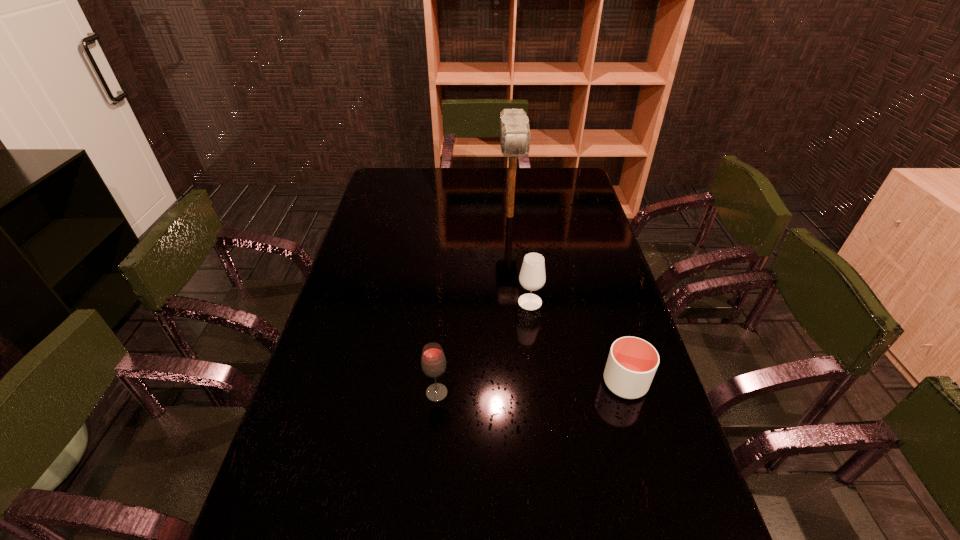
I want to click on vacant point located 0.070m on the front of the leftmost object, so click(434, 429).

The image size is (960, 540). What are the coordinates of `vacant space located 0.170m on the left of the shortest object` in the screenshot? It's located at (x=538, y=383).

Locate an element on the screen. object that is at the right edge is located at coordinates (632, 362).

Locate an element on the screen. vacant space at the far edge of the desktop is located at coordinates (538, 189).

In the image, there is a desktop. Identify the location of vacant space at the left edge. The height and width of the screenshot is (540, 960). (345, 298).

In the image, there is a desktop. Where is `vacant space at the right edge`? The width and height of the screenshot is (960, 540). vacant space at the right edge is located at coordinates (561, 206).

In order to click on vacant space at the far right corner of the desktop in this screenshot , I will do `click(554, 194)`.

Identify the location of vacant area that lies between the third nearest object and the leftmost object. Image resolution: width=960 pixels, height=540 pixels. (484, 347).

You are a GUI agent. You are given a task and a screenshot of the screen. Output one action in this format:
    pyautogui.click(x=<x>, y=<y>)
    Task: Click on the unoccupied area between the shortest object and the nearer glass drink container
    
    Given the screenshot: What is the action you would take?
    pyautogui.click(x=531, y=388)

The width and height of the screenshot is (960, 540). What are the coordinates of `vacant point located between the right glass drink container and the rightmost object` in the screenshot? It's located at (578, 342).